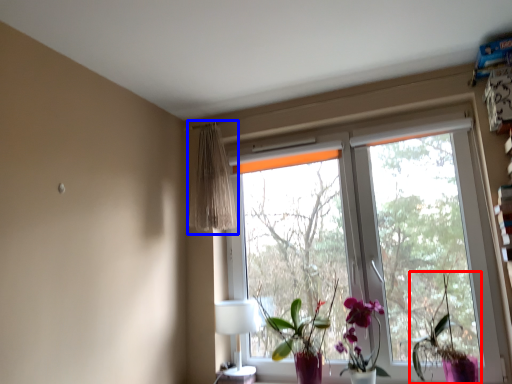
Question: Which point is closer to the camera, houseplant (highlighted by a red box) or curtain (highlighted by a blue box)?

Choices:
 (A) houseplant
 (B) curtain

Answer: (A)